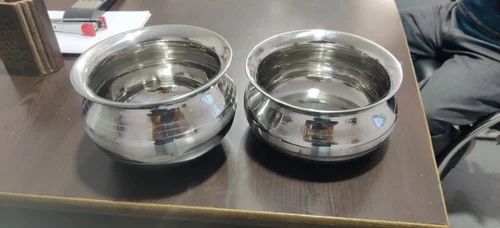
Identify the location of table top. The width and height of the screenshot is (500, 228). (267, 18), (234, 196).